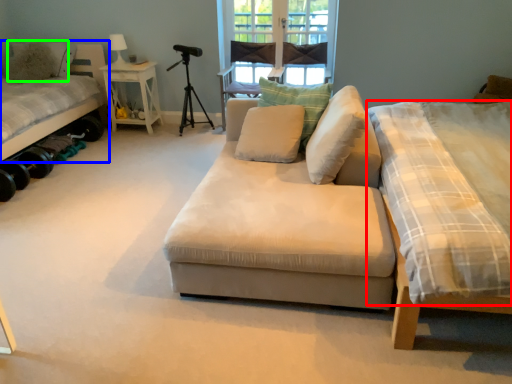
Question: Which object is the closest to the mattress (highlighted by a red box)? Choose among these: bed (highlighted by a blue box) or pillow (highlighted by a green box).

Choices:
 (A) bed
 (B) pillow

Answer: (A)